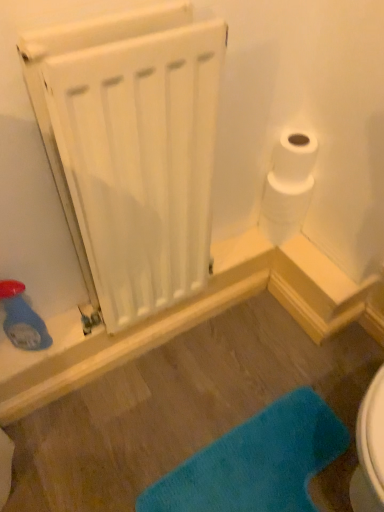
Question: Is white matte radiator at upper left at the back of white matte toilet paper at upper right?

Choices:
 (A) no
 (B) yes

Answer: (A)

Question: From the image's perspective, is white matte toilet paper at upper right below white matte radiator at upper left?

Choices:
 (A) yes
 (B) no

Answer: (B)

Question: Is white matte toilet paper at upper right further to the viewer compared to white matte radiator at upper left?

Choices:
 (A) yes
 (B) no

Answer: (A)

Question: Is white matte toilet paper at upper right shorter than white matte radiator at upper left?

Choices:
 (A) yes
 (B) no

Answer: (A)

Question: Would you say white matte toilet paper at upper right is outside white matte radiator at upper left?

Choices:
 (A) yes
 (B) no

Answer: (A)

Question: Considering their positions, is white matte radiator at upper left located in front of or behind blue fuzzy bath mat at lower center?

Choices:
 (A) behind
 (B) front

Answer: (B)

Question: Is white matte radiator at upper left taller or shorter than blue fuzzy bath mat at lower center?

Choices:
 (A) tall
 (B) short

Answer: (A)

Question: Is point (89, 293) closer or farther from the camera than point (185, 480)?

Choices:
 (A) farther
 (B) closer

Answer: (A)

Question: Looking at the image, does white matte radiator at upper left seem bigger or smaller compared to blue fuzzy bath mat at lower center?

Choices:
 (A) small
 (B) big

Answer: (B)

Question: Considering the relative positions of white matte toilet paper at upper right and white matte radiator at upper left in the image provided, is white matte toilet paper at upper right to the left or to the right of white matte radiator at upper left?

Choices:
 (A) left
 (B) right

Answer: (B)

Question: Is point (274, 216) positioned closer to the camera than point (100, 245)?

Choices:
 (A) closer
 (B) farther

Answer: (B)

Question: Do you think white matte toilet paper at upper right is within white matte radiator at upper left, or outside of it?

Choices:
 (A) outside
 (B) inside

Answer: (A)

Question: From the image's perspective, is white matte toilet paper at upper right above or below white matte radiator at upper left?

Choices:
 (A) below
 (B) above

Answer: (B)

Question: Is blue fuzzy bath mat at lower center wider or thinner than white matte radiator at upper left?

Choices:
 (A) thin
 (B) wide

Answer: (B)

Question: Considering the relative positions of blue fuzzy bath mat at lower center and white matte radiator at upper left in the image provided, is blue fuzzy bath mat at lower center to the left or to the right of white matte radiator at upper left?

Choices:
 (A) right
 (B) left

Answer: (A)